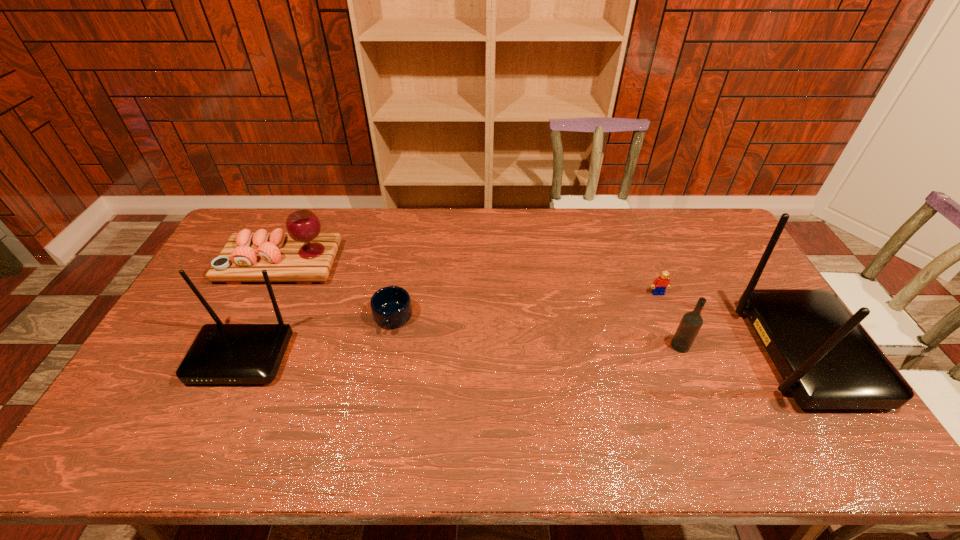
Identify the location of the fifth shortest object. Image resolution: width=960 pixels, height=540 pixels. (221, 353).

Locate an element on the screen. The height and width of the screenshot is (540, 960). the shorter router is located at coordinates (x=221, y=353).

Image resolution: width=960 pixels, height=540 pixels. Find the location of `the taller router`. the taller router is located at coordinates (827, 360).

Image resolution: width=960 pixels, height=540 pixels. Find the location of `the tallest object`. the tallest object is located at coordinates (827, 360).

Identify the location of the shortest object. (391, 307).

Locate an element on the screen. The image size is (960, 540). mug is located at coordinates click(x=391, y=307).

You are a GUI agent. You are given a task and a screenshot of the screen. Output one action in this format:
    pyautogui.click(x=<x>, y=<y>)
    Task: Click on the fifth nearest object
    Image resolution: width=960 pixels, height=540 pixels.
    Given the screenshot: What is the action you would take?
    pyautogui.click(x=660, y=284)

Identify the location of Lego. (660, 284).

I want to click on vodka, so click(x=691, y=322).

I want to click on platter, so [x=304, y=255].